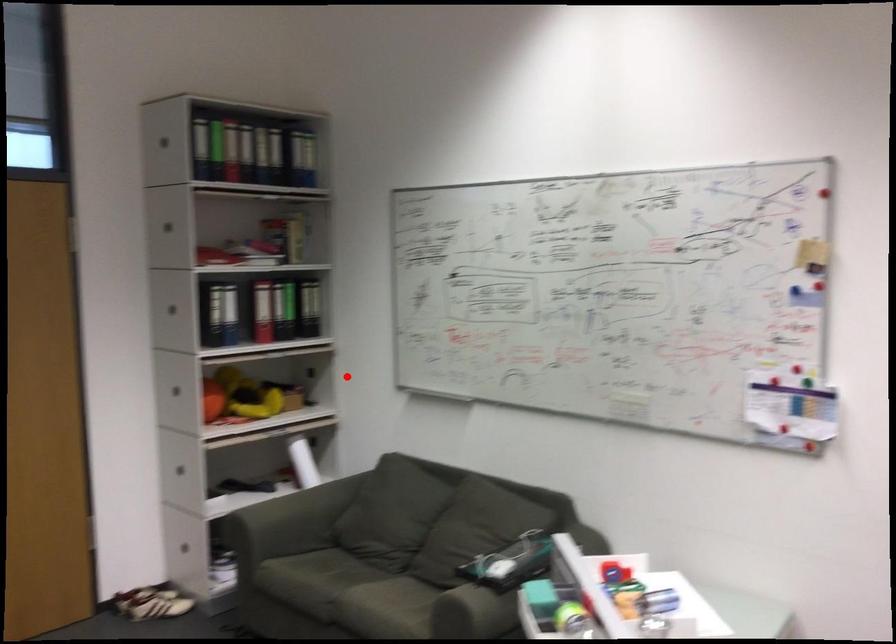
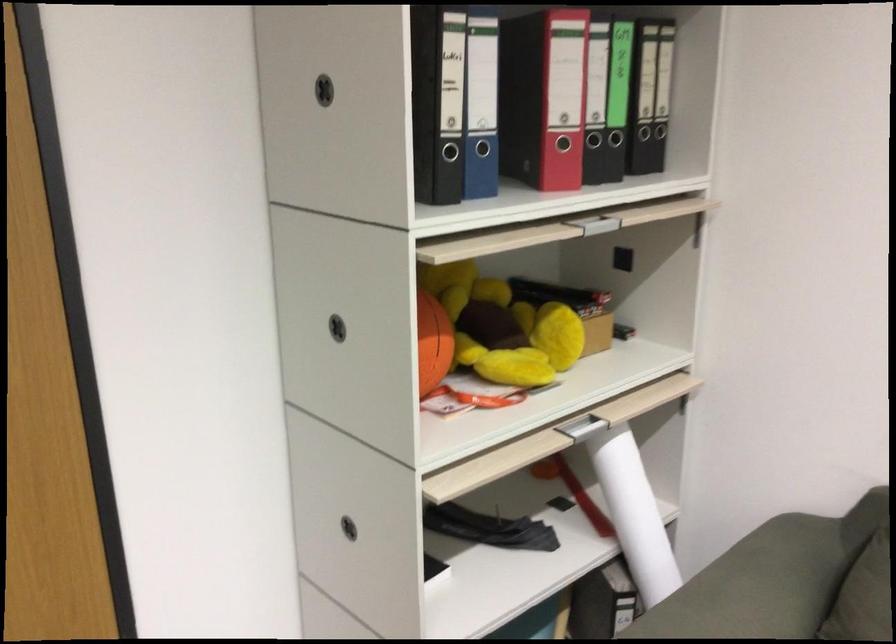
Question: A red point is marked in image1. In image2, is the corresponding 3D point closer to the camera or farther? Reply with the corresponding letter.

Choices:
 (A) The corresponding 3D point is closer.
 (B) The corresponding 3D point is farther.

Answer: (A)